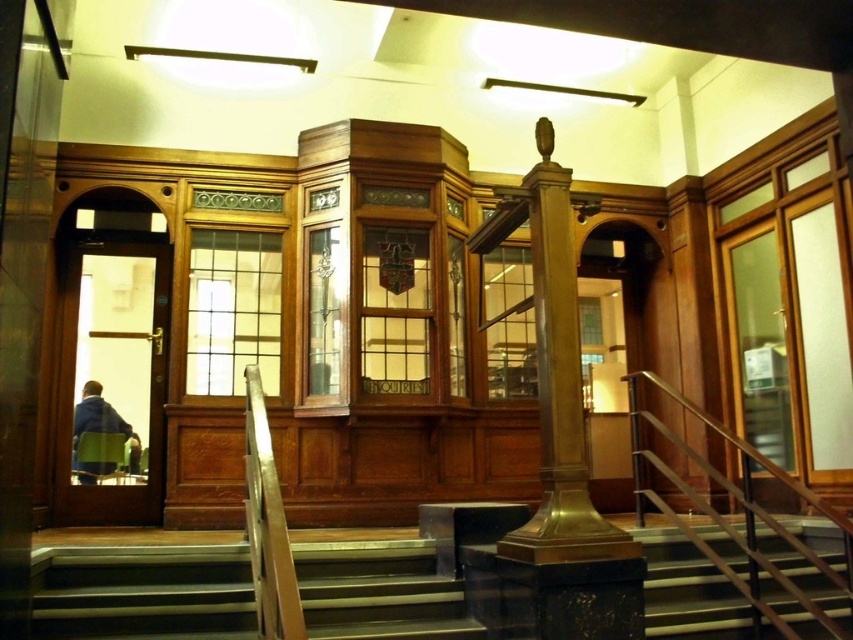
Question: Is wooden stairs at center positioned in front of polished metal railing at right?

Choices:
 (A) yes
 (B) no

Answer: (A)

Question: Which object is farther from the camera taking this photo?

Choices:
 (A) polished marble steps at center
 (B) polished metal railing at right

Answer: (A)

Question: Which object is the farthest from the polished marble steps at center?

Choices:
 (A) polished metal railing at right
 (B) blue fabric jacket at left

Answer: (B)

Question: Can you confirm if wooden stairs at center is thinner than polished metal railing at right?

Choices:
 (A) yes
 (B) no

Answer: (A)

Question: Considering the real-world distances, which object is farthest from the polished metal railing at right?

Choices:
 (A) blue fabric jacket at left
 (B) polished marble steps at center
 (C) polished brass column at center
 (D) wooden stairs at center

Answer: (A)

Question: Is polished marble steps at center wider than polished brass column at center?

Choices:
 (A) no
 (B) yes

Answer: (B)